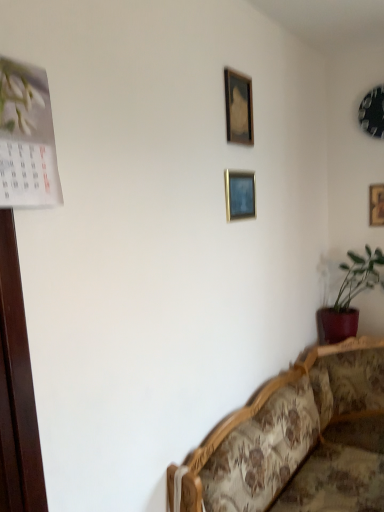
Question: Considering the relative sizes of metallic clock at upper right, the third picture frame in the front-to-back sequence, and floral fabric couch at lower right in the image provided, is metallic clock at upper right, the third picture frame in the front-to-back sequence, shorter than floral fabric couch at lower right?

Choices:
 (A) no
 (B) yes

Answer: (B)

Question: From a real-world perspective, is metallic clock at upper right, the third picture frame in the front-to-back sequence, beneath floral fabric couch at lower right?

Choices:
 (A) no
 (B) yes

Answer: (A)

Question: Does metallic clock at upper right, acting as the third picture frame starting from the left, have a greater width compared to floral fabric couch at lower right?

Choices:
 (A) no
 (B) yes

Answer: (A)

Question: Is metallic clock at upper right, the third picture frame in the front-to-back sequence, closer to the viewer compared to floral fabric couch at lower right?

Choices:
 (A) yes
 (B) no

Answer: (B)

Question: From the image's perspective, is metallic clock at upper right, the 2th picture frame from the right, on floral fabric couch at lower right?

Choices:
 (A) no
 (B) yes

Answer: (B)

Question: Is metallic clock at upper right, the 2th picture frame from the right, positioned beyond the bounds of floral fabric couch at lower right?

Choices:
 (A) no
 (B) yes

Answer: (B)

Question: Would you say wooden picture frame at right, the first picture frame in the right-to-left sequence, contains wooden picture frame at upper center, the 4th picture frame in the back-to-front sequence?

Choices:
 (A) yes
 (B) no

Answer: (B)

Question: Can you confirm if wooden picture frame at right, acting as the 1th picture frame starting from the back, is wider than wooden picture frame at upper center, which appears as the 1th picture frame when viewed from the front?

Choices:
 (A) no
 (B) yes

Answer: (B)

Question: Considering the relative sizes of wooden picture frame at right, placed as the fourth picture frame when sorted from left to right, and wooden picture frame at upper center, which appears as the 1th picture frame when viewed from the front, in the image provided, is wooden picture frame at right, placed as the fourth picture frame when sorted from left to right, thinner than wooden picture frame at upper center, which appears as the 1th picture frame when viewed from the front,?

Choices:
 (A) yes
 (B) no

Answer: (B)

Question: Is wooden picture frame at right, the fourth picture frame from the front, not within wooden picture frame at upper center, the 4th picture frame in the back-to-front sequence?

Choices:
 (A) yes
 (B) no

Answer: (A)

Question: Can you confirm if wooden picture frame at right, acting as the 1th picture frame starting from the back, is taller than wooden picture frame at upper center, the fourth picture frame from the right?

Choices:
 (A) yes
 (B) no

Answer: (B)

Question: Is wooden picture frame at right, placed as the fourth picture frame when sorted from left to right, far away from wooden picture frame at upper center, the 1th picture frame positioned from the left?

Choices:
 (A) yes
 (B) no

Answer: (A)

Question: Could you tell me if floral fabric couch at lower right is turned towards matte wooden picture frame at upper center, acting as the 3th picture frame starting from the right?

Choices:
 (A) yes
 (B) no

Answer: (B)